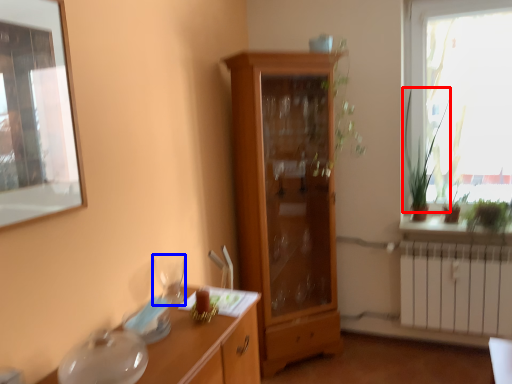
Question: Which object appears farthest to the camera in this image, plant (highlighted by a red box) or tableware (highlighted by a blue box)?

Choices:
 (A) plant
 (B) tableware

Answer: (A)